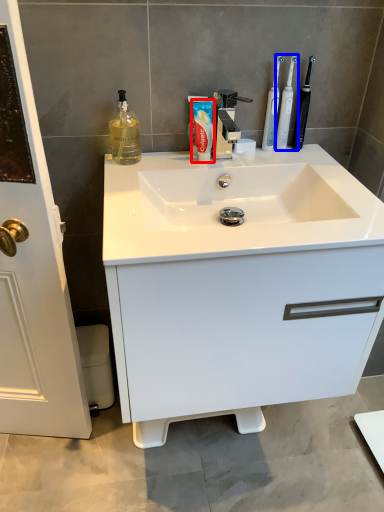
Question: Among these objects, which one is nearest to the camera, shaving cream (highlighted by a red box) or toothbrush (highlighted by a blue box)?

Choices:
 (A) shaving cream
 (B) toothbrush

Answer: (A)